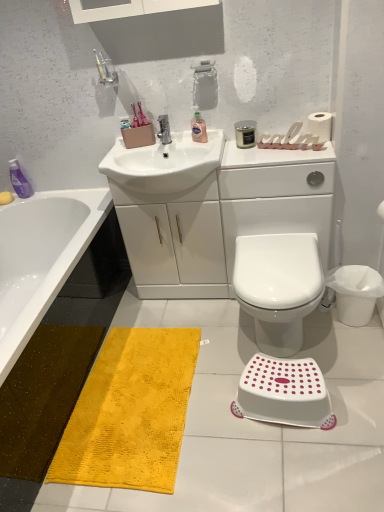
At what (x,y) coordinates should I click in order to perform the action: click on vacant area located to the right-hand side of metallic faucet at center. Please return your answer as a coordinate pair (x, y). The image size is (384, 512). Looking at the image, I should click on (198, 140).